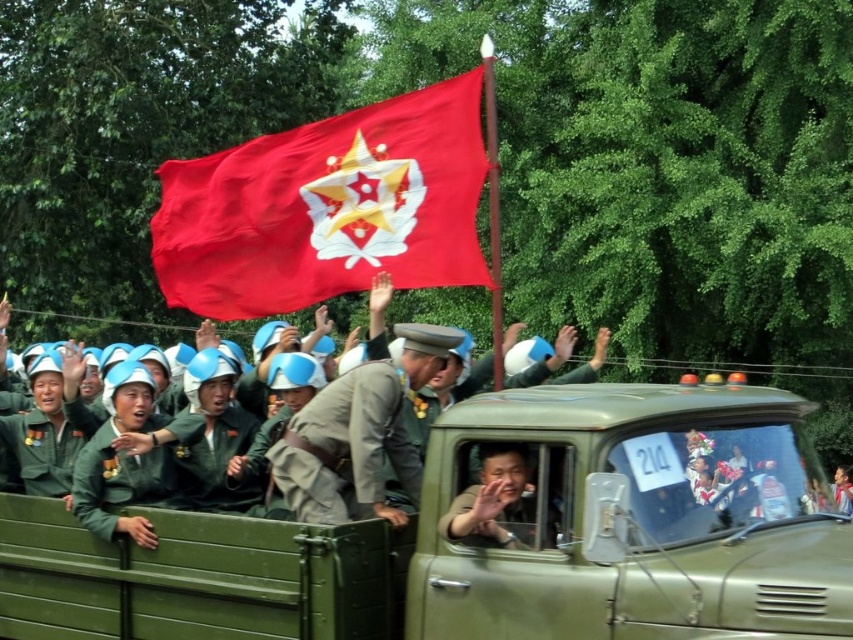
Question: Among these objects, which one is farthest from the camera?

Choices:
 (A) green matte truck at center
 (B) khaki uniform at center
 (C) matte green uniform at center

Answer: (C)

Question: Does green matte truck at center have a larger size compared to matte green uniform at center?

Choices:
 (A) yes
 (B) no

Answer: (A)

Question: Which point is farther to the camera?

Choices:
 (A) (144, 570)
 (B) (328, 237)

Answer: (B)

Question: Which point is closer to the camera?

Choices:
 (A) (228, 224)
 (B) (314, 518)

Answer: (B)

Question: Does green matte truck at center have a smaller size compared to matte green uniform at center?

Choices:
 (A) no
 (B) yes

Answer: (A)

Question: Is red matte flag at center closer to camera compared to matte green uniform at center?

Choices:
 (A) yes
 (B) no

Answer: (B)